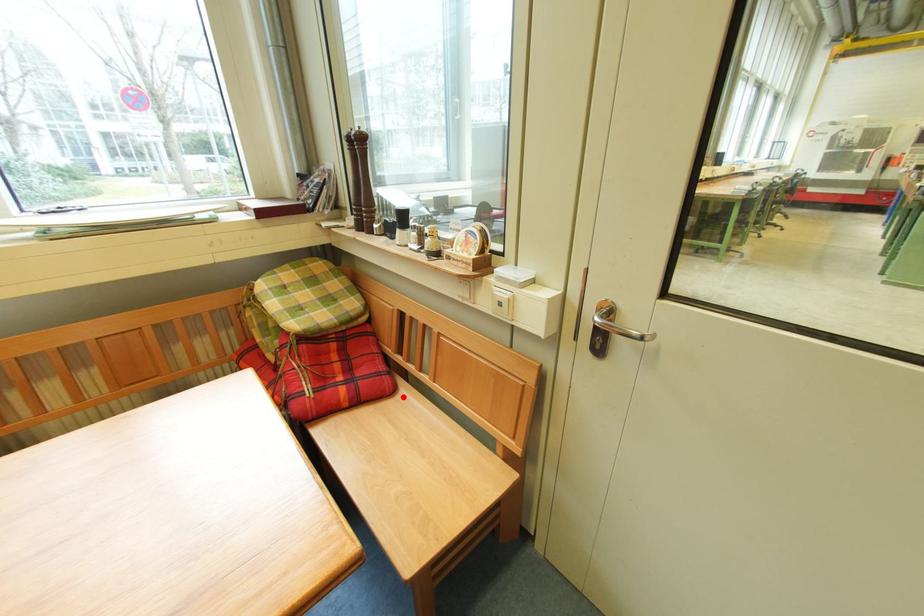
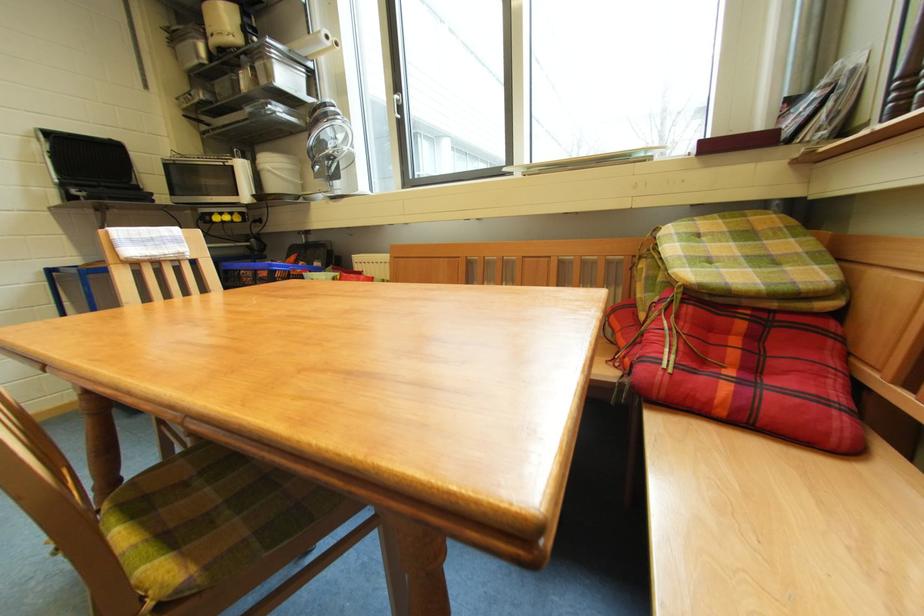
Question: I am providing you with two images of the same scene from different viewpoints. Image1 has a red point marked. In image2, the corresponding 3D location appears at what relative position? Reply with the corresponding letter.

Choices:
 (A) Closer
 (B) Farther

Answer: (B)